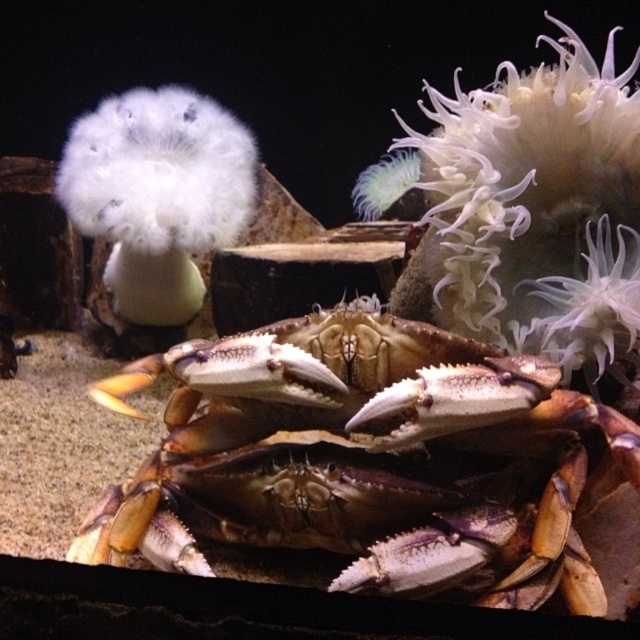
Question: Which of the following is the closest to the observer?

Choices:
 (A) white fluffy anemone at center
 (B) brown hard shell crab at center

Answer: (B)

Question: Is brown hard shell crab at center to the left of white fluffy anemone at center from the viewer's perspective?

Choices:
 (A) no
 (B) yes

Answer: (A)

Question: Does brown hard shell crab at center appear on the left side of white fluffy anemone at center?

Choices:
 (A) no
 (B) yes

Answer: (A)

Question: Is brown hard shell crab at center thinner than white fluffy anemone at center?

Choices:
 (A) no
 (B) yes

Answer: (A)